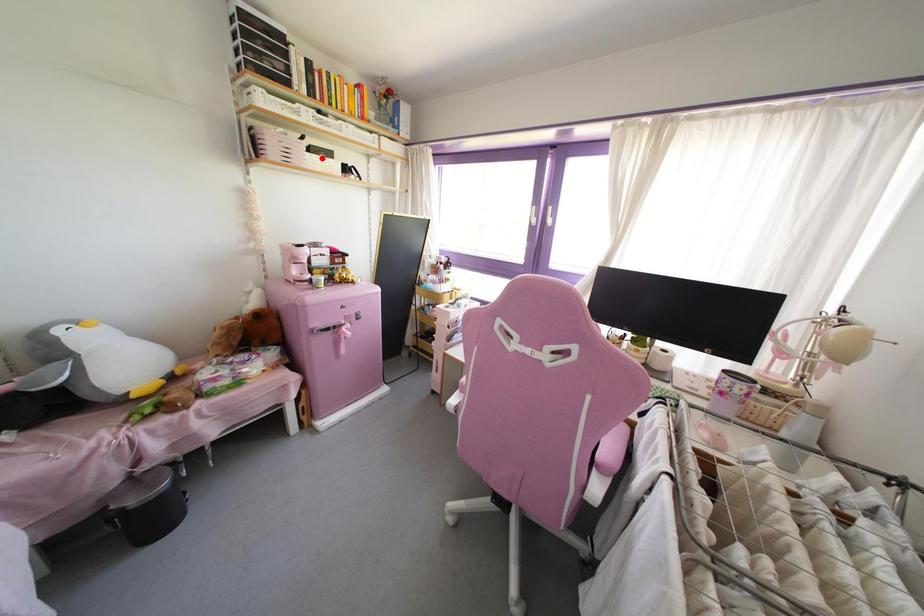
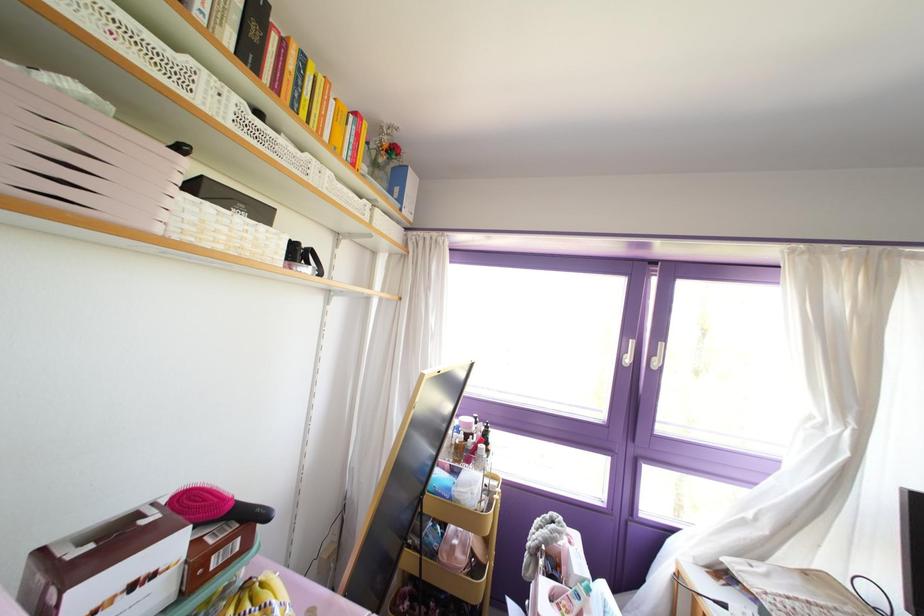
Question: I am providing you with two images of the same scene from different viewpoints. A red point is marked on the first image. Can you still see the location of the red point in image 2?

Choices:
 (A) Yes
 (B) No

Answer: (A)